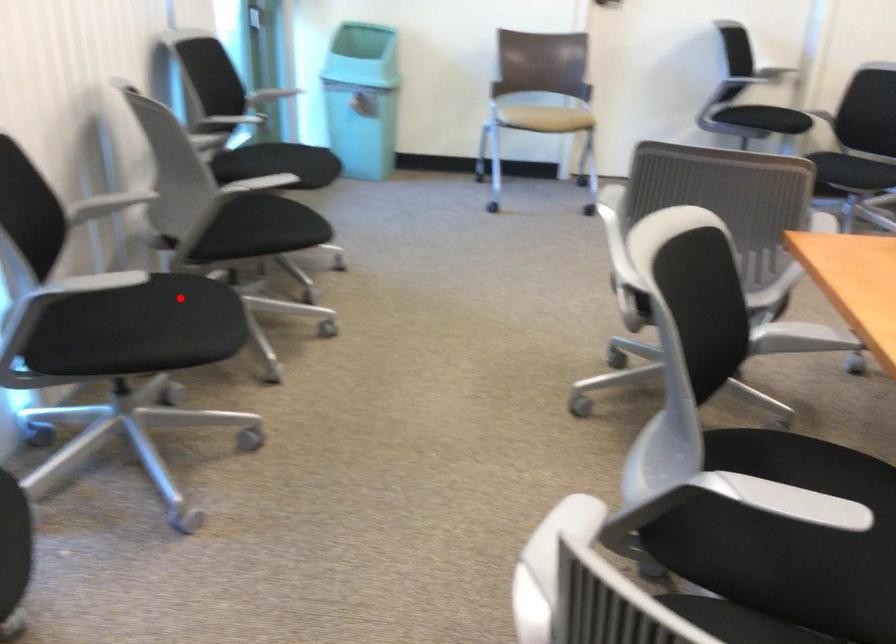
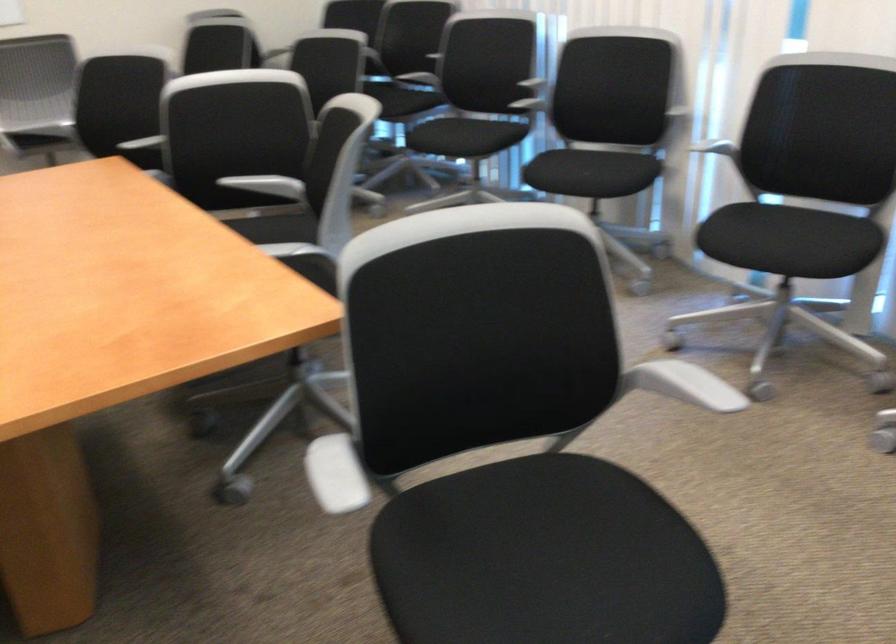
Locate, in the second image, the point that corresponds to the highlighted location in the first image.

(789, 240)